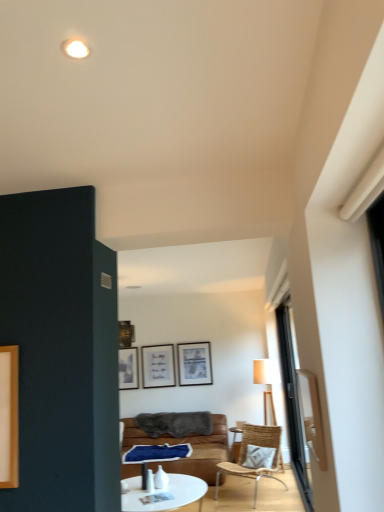
Question: Considering the relative positions of white textured pillow at lower right and white glossy coffee table at center in the image provided, is white textured pillow at lower right to the left or to the right of white glossy coffee table at center?

Choices:
 (A) left
 (B) right

Answer: (B)

Question: Is white textured pillow at lower right wider or thinner than white glossy coffee table at center?

Choices:
 (A) thin
 (B) wide

Answer: (A)

Question: Considering the real-world distances, which object is farthest from the brown leather couch at center?

Choices:
 (A) matte black picture frame at upper center
 (B) white glossy coffee table at center
 (C) transparent glass door at right
 (D) transparent glass door at right
 (E) white textured pillow at lower right

Answer: (D)

Question: Which is nearer to the transparent glass door at right?

Choices:
 (A) matte black picture frame at upper center
 (B) woven wood chair at center
 (C) white textured pillow at lower right
 (D) brown leather couch at center
 (E) white glossy coffee table at center

Answer: (E)